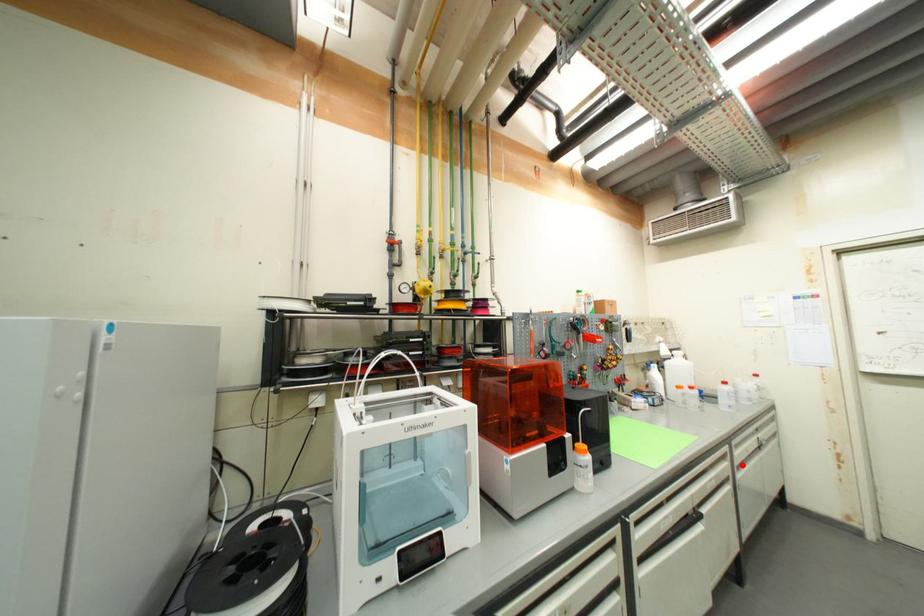
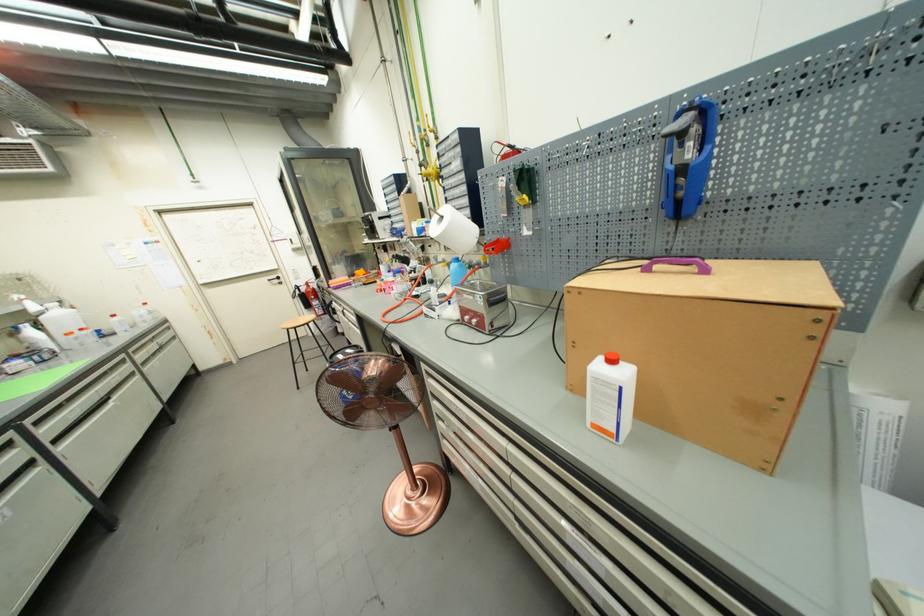
Question: I am providing you with two images of the same scene from different viewpoints. A red point is shown in image1. For the corresponding object point in image2, is it positioned nearer or farther from the camera?

Choices:
 (A) Nearer
 (B) Farther

Answer: (B)